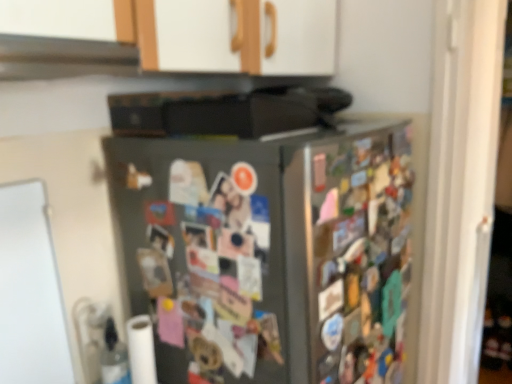
Question: Is black matte exhaust hood at upper center facing away from satin silver refrigerator at center?

Choices:
 (A) yes
 (B) no

Answer: (B)

Question: Is satin silver refrigerator at center a part of black matte exhaust hood at upper center?

Choices:
 (A) no
 (B) yes

Answer: (A)

Question: Is black matte exhaust hood at upper center bigger than satin silver refrigerator at center?

Choices:
 (A) no
 (B) yes

Answer: (A)

Question: Is black matte exhaust hood at upper center outside satin silver refrigerator at center?

Choices:
 (A) no
 (B) yes

Answer: (B)

Question: From the image's perspective, is black matte exhaust hood at upper center above satin silver refrigerator at center?

Choices:
 (A) yes
 (B) no

Answer: (A)

Question: From the image's perspective, is black matte exhaust hood at upper center above or below white matte toilet paper at lower left?

Choices:
 (A) above
 (B) below

Answer: (A)

Question: From a real-world perspective, is black matte exhaust hood at upper center physically located above or below white matte toilet paper at lower left?

Choices:
 (A) above
 (B) below

Answer: (A)

Question: Considering the positions of point (134, 51) and point (142, 331), is point (134, 51) closer or farther from the camera than point (142, 331)?

Choices:
 (A) farther
 (B) closer

Answer: (B)

Question: Based on their sizes in the image, would you say black matte exhaust hood at upper center is bigger or smaller than white matte toilet paper at lower left?

Choices:
 (A) big
 (B) small

Answer: (A)

Question: From a real-world perspective, is satin silver refrigerator at center positioned above or below white matte toilet paper at lower left?

Choices:
 (A) below
 (B) above

Answer: (B)

Question: Is satin silver refrigerator at center inside the boundaries of white matte toilet paper at lower left, or outside?

Choices:
 (A) outside
 (B) inside

Answer: (A)

Question: From the image's perspective, is satin silver refrigerator at center above or below white matte toilet paper at lower left?

Choices:
 (A) above
 (B) below

Answer: (A)

Question: In terms of width, does satin silver refrigerator at center look wider or thinner when compared to white matte toilet paper at lower left?

Choices:
 (A) thin
 (B) wide

Answer: (B)

Question: Is point (286, 311) positioned closer to the camera than point (110, 72)?

Choices:
 (A) closer
 (B) farther

Answer: (A)

Question: Considering the positions of satin silver refrigerator at center and black matte exhaust hood at upper center in the image, is satin silver refrigerator at center wider or thinner than black matte exhaust hood at upper center?

Choices:
 (A) wide
 (B) thin

Answer: (A)